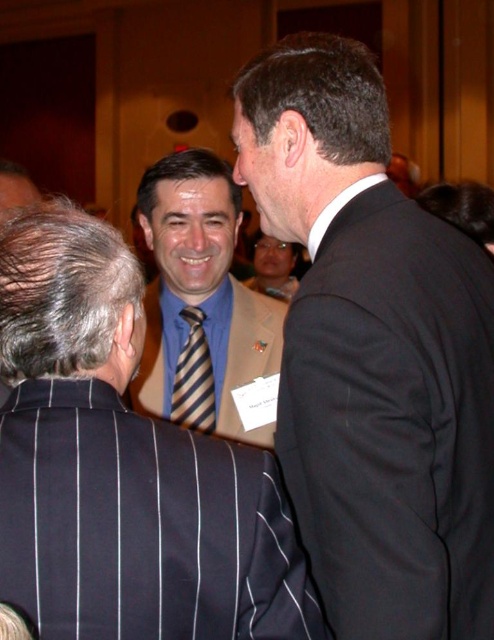
Question: Does black suit at right appear on the right side of striped fabric tie at center?

Choices:
 (A) yes
 (B) no

Answer: (A)

Question: Which point appears farthest from the camera in this image?

Choices:
 (A) (142, 404)
 (B) (197, 384)

Answer: (B)

Question: Is striped tie at center thinner than striped fabric tie at center?

Choices:
 (A) no
 (B) yes

Answer: (A)

Question: Which of the following is the farthest from the observer?

Choices:
 (A) (195, 342)
 (B) (248, 307)

Answer: (B)

Question: Which is nearer to the blue striped tie at center?

Choices:
 (A) black suit at right
 (B) striped fabric tie at center
 (C) striped tie at center

Answer: (A)

Question: Is striped tie at center to the right of striped fabric tie at center from the viewer's perspective?

Choices:
 (A) yes
 (B) no

Answer: (A)